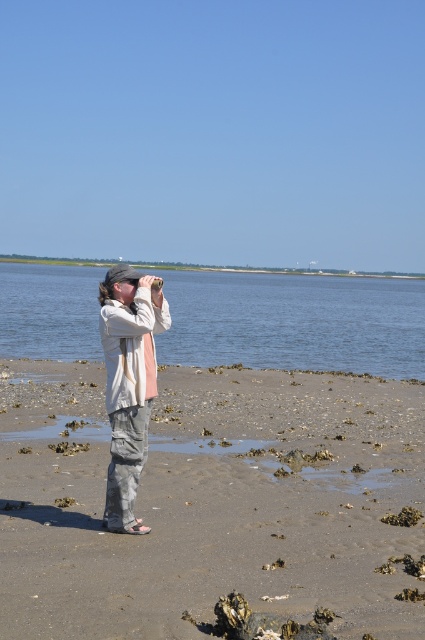
Question: Can you confirm if brown sandy beach at center is positioned above blue water at center?

Choices:
 (A) yes
 (B) no

Answer: (B)

Question: Is brown sandy beach at center positioned before light gray cotton pants at center?

Choices:
 (A) yes
 (B) no

Answer: (A)

Question: Which of the following is the closest to the observer?

Choices:
 (A) blue water at center
 (B) brown sandy beach at center
 (C) light gray cotton pants at center

Answer: (B)

Question: Which point is farther to the camera?

Choices:
 (A) 408,352
 (B) 130,285
 (C) 359,392

Answer: (A)

Question: Is brown sandy beach at center smaller than blue water at center?

Choices:
 (A) yes
 (B) no

Answer: (A)

Question: Which point is farther from the camera taking this photo?

Choices:
 (A) coord(56,532)
 (B) coord(50,298)
 (C) coord(110,449)

Answer: (B)